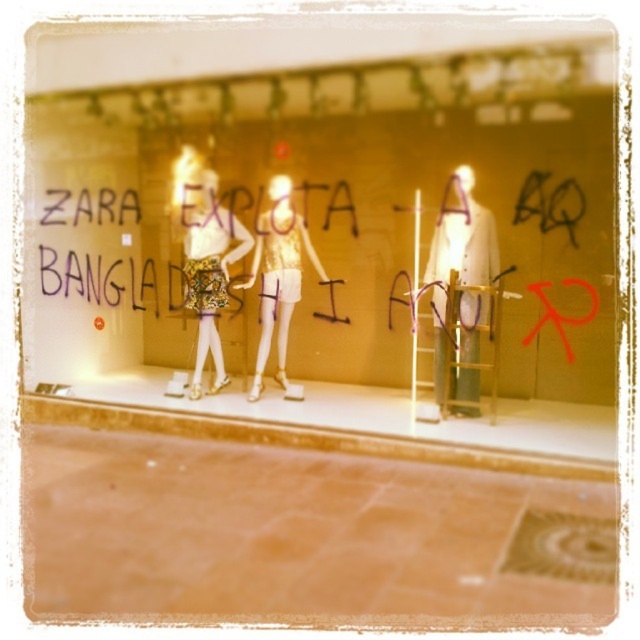
You are a window designer who wants to ensure all items in the storefront display are visible. Given that the white fabric coat at center and the metallic gold dress at center are both at the center, which item might be more likely to block the view of the other due to its size?

The metallic gold dress at center has a greater width than the white fabric coat at center, so it might block the view of the white fabric coat at center more easily.

You are a delivery person who needs to place a new mannequin between the white fabric coat at center and the gold sequined dress at center. The mannequin is 1.5 meters tall. Can it fit vertically between them?

The distance between the white fabric coat at center and the gold sequined dress at center is 1.83 meters. Since the mannequin is only 1.5 meters tall, it can fit vertically between them as the space is larger than the mannequin.

You are standing in front of the storefront window display. You see a graffiti text at point (461, 289). What is the object located at that point?

The point (461, 289) corresponds to the white fabric coat at center.